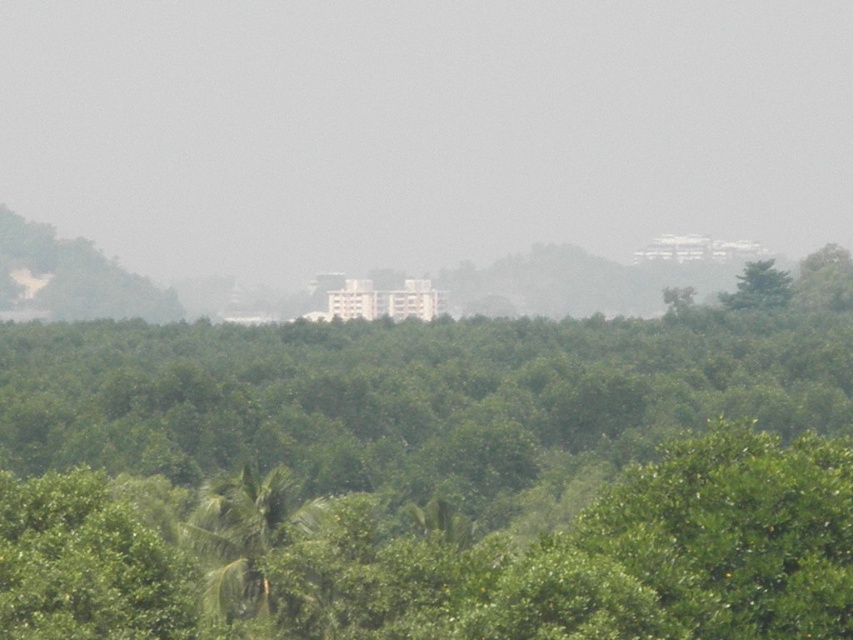
Is green leafy forest at center to the left of green leafy tree at upper right from the viewer's perspective?

Correct, you'll find green leafy forest at center to the left of green leafy tree at upper right.

Who is more forward, (508, 634) or (733, 300)?

Point (508, 634) is more forward.

Find the location of a particular element. green leafy forest at center is located at coordinates (434, 476).